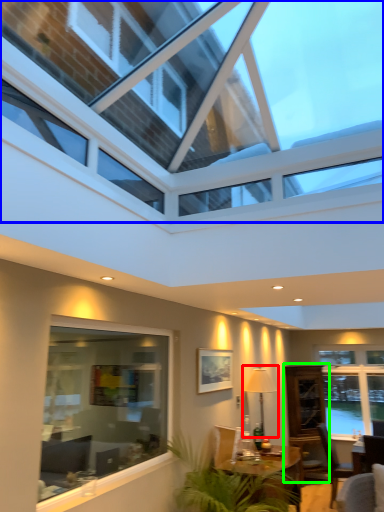
Question: Considering the real-world distances, which object is closest to lamp (highlighted by a red box)? window (highlighted by a blue box) or glass door (highlighted by a green box).

Choices:
 (A) window
 (B) glass door

Answer: (B)